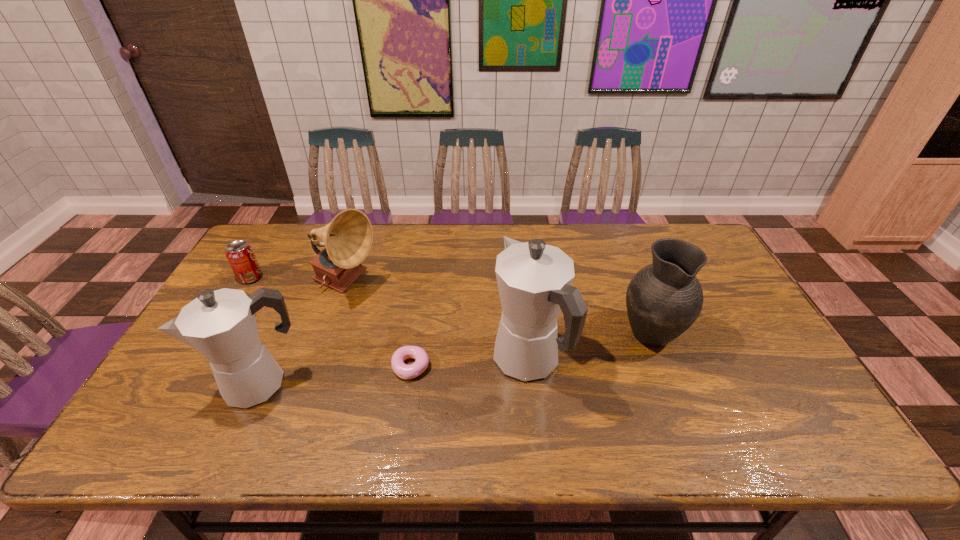
At what (x,y) coordinates should I click in order to perform the action: click on blank space located 0.080m on the right of the taller coffeepot. Please return your answer as a coordinate pair (x, y). Looking at the image, I should click on (593, 361).

Where is `free space located on the right of the leftmost object`? free space located on the right of the leftmost object is located at coordinates (388, 277).

This screenshot has height=540, width=960. Find the location of `vacant space located on the side of the rightmost object with the handle`. vacant space located on the side of the rightmost object with the handle is located at coordinates (629, 278).

This screenshot has height=540, width=960. Find the location of `vacant point located 0.080m on the side of the rightmost object with the handle`. vacant point located 0.080m on the side of the rightmost object with the handle is located at coordinates (634, 288).

This screenshot has width=960, height=540. I want to click on vacant region located 0.230m on the side of the rightmost object with the handle, so click(621, 258).

Locate an element on the screen. free space located on the horn of the phonograph record is located at coordinates (422, 284).

This screenshot has width=960, height=540. Find the location of `blank space located on the back of the fourth object from left to right`. blank space located on the back of the fourth object from left to right is located at coordinates (416, 335).

The image size is (960, 540). In order to click on object that is at the far edge in this screenshot , I will do `click(348, 238)`.

This screenshot has width=960, height=540. Find the location of `doughnut that is positioned at the near edge`. doughnut that is positioned at the near edge is located at coordinates (402, 370).

Identify the location of coffeepot located at the left edge. The image size is (960, 540). (221, 325).